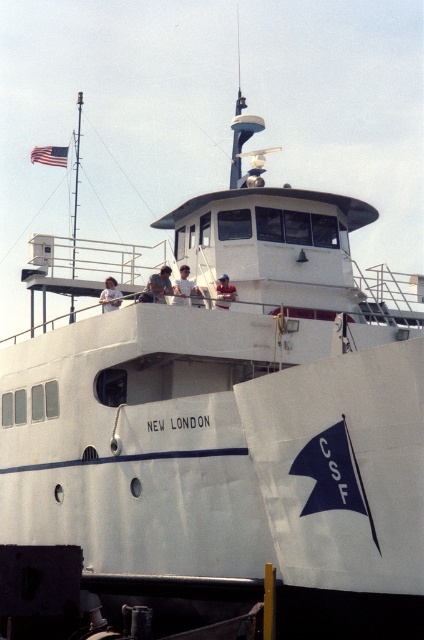
Identify the location of matte skin person at center. (156, 285).

Between matte skin person at center and light brown hair at upper center, which one is positioned lower?

light brown hair at upper center is below.

Describe the element at coordinates (156, 285) in the screenshot. The height and width of the screenshot is (640, 424). I see `matte skin person at center` at that location.

Find the location of `matte skin person at center`. matte skin person at center is located at coordinates (156, 285).

Does matte skin person at center appear under light brown wooden stick at center?

No.

Does matte skin person at center have a greater width compared to light brown wooden stick at center?

Yes.

Who is more distant from viewer, (167, 266) or (233, 285)?

The point (233, 285) is more distant.

The width and height of the screenshot is (424, 640). In order to click on matte skin person at center in this screenshot , I will do `click(156, 285)`.

Is light brown hair at upper center below light brown wooden stick at center?

Yes.

Can you confirm if light brown hair at upper center is wider than light brown wooden stick at center?

Correct, the width of light brown hair at upper center exceeds that of light brown wooden stick at center.

This screenshot has width=424, height=640. What do you see at coordinates (109, 296) in the screenshot?
I see `light brown hair at upper center` at bounding box center [109, 296].

This screenshot has width=424, height=640. I want to click on light brown hair at upper center, so coord(109,296).